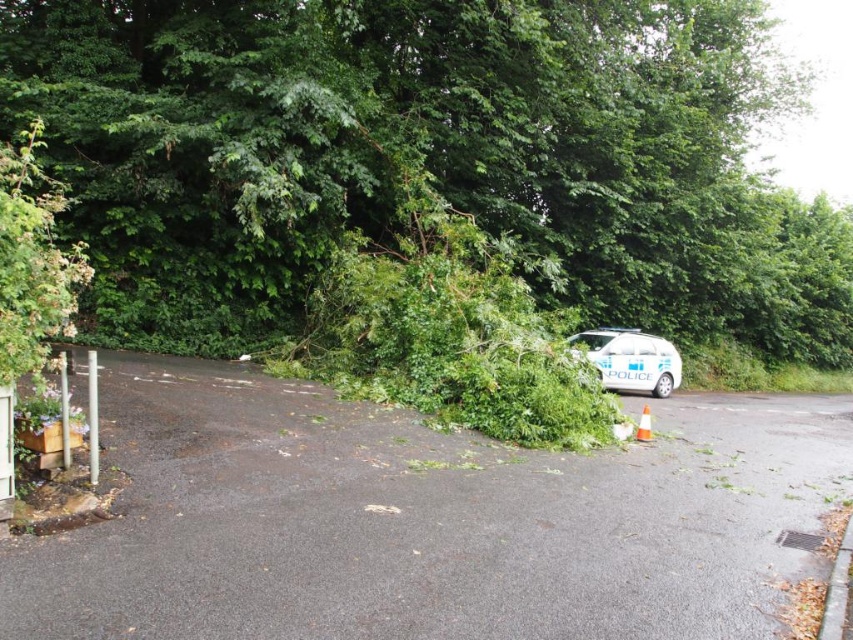
Question: Which object is closer to the camera taking this photo?

Choices:
 (A) green leafy tree at center
 (B) white metallic police car at center

Answer: (A)

Question: Which point is closer to the camera taking this photo?

Choices:
 (A) (434, 157)
 (B) (637, 372)

Answer: (A)

Question: Is green leafy tree at center thinner than white metallic police car at center?

Choices:
 (A) no
 (B) yes

Answer: (A)

Question: Does green leafy tree at center have a greater width compared to white metallic police car at center?

Choices:
 (A) no
 (B) yes

Answer: (B)

Question: Which point appears closest to the camera in this image?

Choices:
 (A) (784, 84)
 (B) (630, 332)

Answer: (B)

Question: In this image, where is green leafy tree at center located relative to white metallic police car at center?

Choices:
 (A) right
 (B) left

Answer: (A)